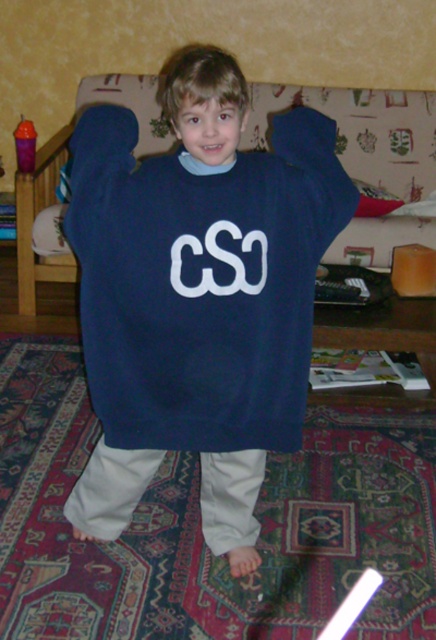
Question: Which of the following is the closest to the observer?

Choices:
 (A) navy blue sweater at center
 (B) white matte cso at center

Answer: (A)

Question: From the image, what is the correct spatial relationship of navy blue sweater at center in relation to white matte cso at center?

Choices:
 (A) left
 (B) right

Answer: (A)

Question: Does navy blue sweater at center have a greater width compared to white matte cso at center?

Choices:
 (A) no
 (B) yes

Answer: (B)

Question: Which object appears closest to the camera in this image?

Choices:
 (A) white matte cso at center
 (B) navy blue sweater at center

Answer: (B)

Question: Is navy blue sweater at center to the right of white matte cso at center from the viewer's perspective?

Choices:
 (A) no
 (B) yes

Answer: (A)